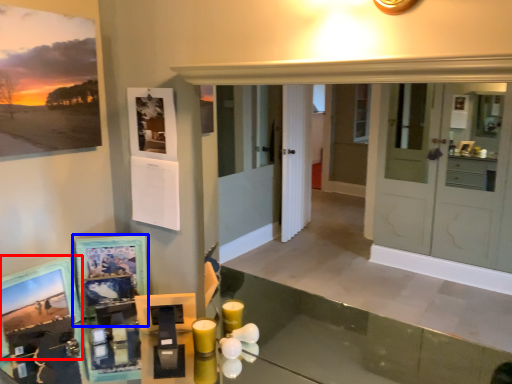
Question: Which object is further to the camera taking this photo, picture frame (highlighted by a red box) or picture frame (highlighted by a blue box)?

Choices:
 (A) picture frame
 (B) picture frame

Answer: (B)